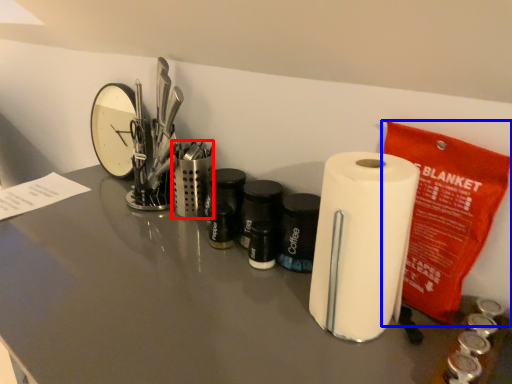
Question: Which object is closer to the camera taking this photo, stationery (highlighted by a red box) or stationery (highlighted by a blue box)?

Choices:
 (A) stationery
 (B) stationery

Answer: (B)